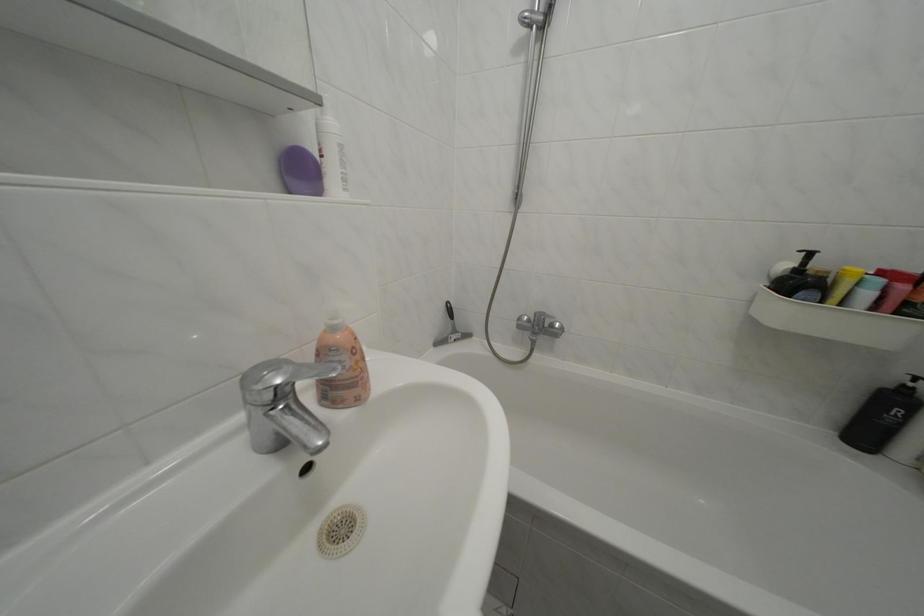
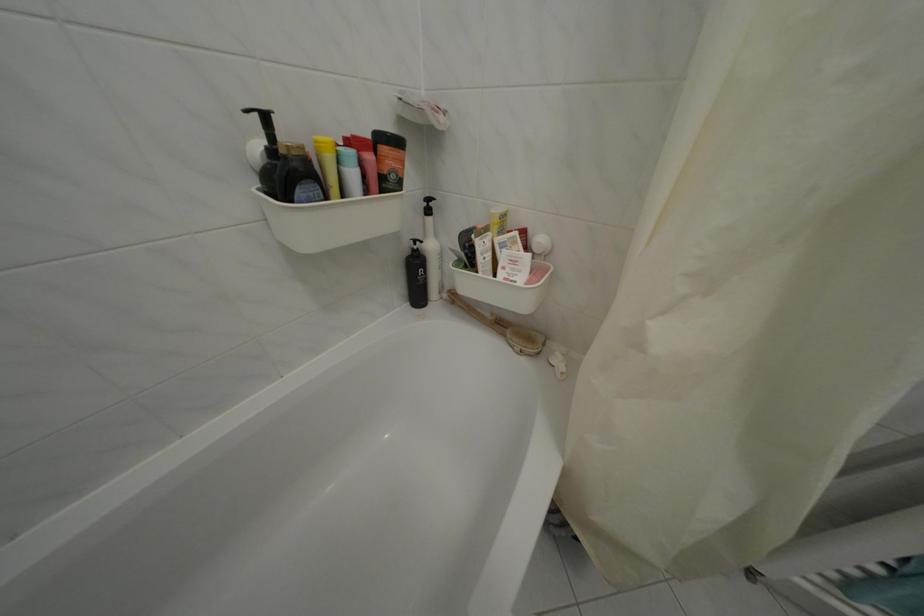
First-person continuous shooting, in which direction is the camera rotating?

The camera's rotation is toward right-down.